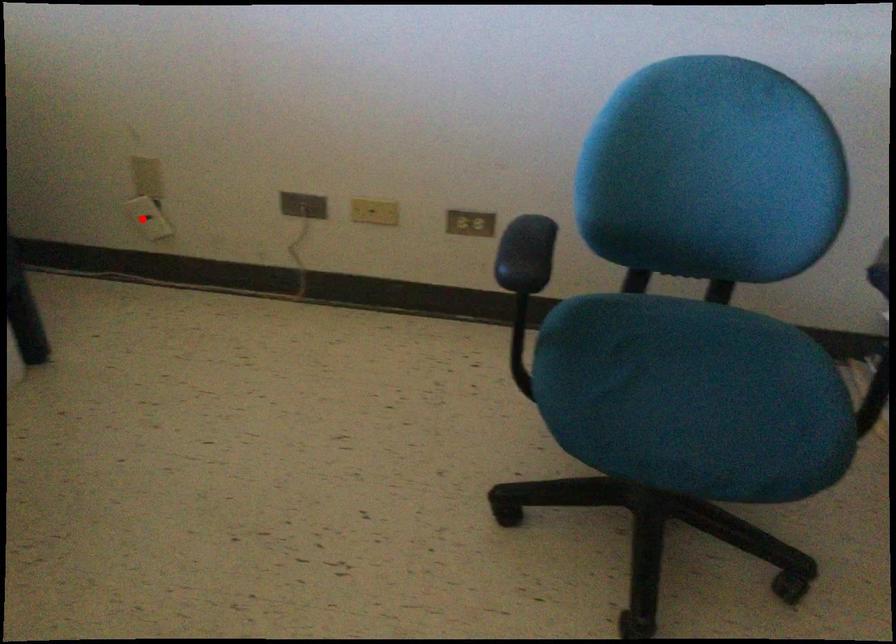
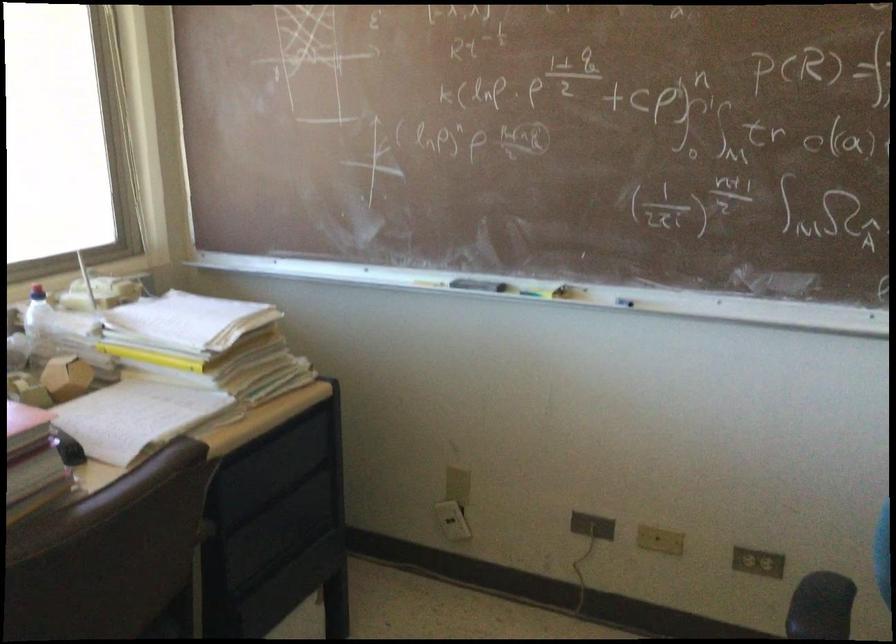
Locate, in the second image, the point that corresponds to the highlighted location in the first image.

(452, 520)